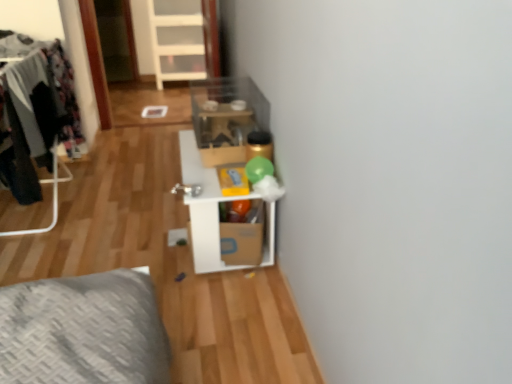
Image resolution: width=512 pixels, height=384 pixels. In order to click on white plastic ladder at upper center in this screenshot , I will do `click(178, 40)`.

The width and height of the screenshot is (512, 384). What do you see at coordinates (178, 40) in the screenshot?
I see `white plastic ladder at upper center` at bounding box center [178, 40].

Describe the element at coordinates (243, 240) in the screenshot. The image size is (512, 384). I see `cardboard box at center` at that location.

Identify the location of white cardboard shelf at center. This screenshot has height=384, width=512. (204, 208).

You are a GUI agent. You are given a task and a screenshot of the screen. Output one action in this format:
    pyautogui.click(x=<x>, y=<y>)
    Task: Click on the clothing lying on the left of white cardboard shelf at center
    
    Given the screenshot: What is the action you would take?
    pyautogui.click(x=37, y=118)

Based on the photo, how distant is dark gray fabric clothes at left from white cardboard shelf at center?

A distance of 31.70 inches exists between dark gray fabric clothes at left and white cardboard shelf at center.

Considering the positions of objects dark gray fabric clothes at left and white cardboard shelf at center in the image provided, who is more to the left, dark gray fabric clothes at left or white cardboard shelf at center?

Positioned to the left is dark gray fabric clothes at left.

Considering the relative sizes of dark gray fabric clothes at left and white cardboard shelf at center in the image provided, is dark gray fabric clothes at left bigger than white cardboard shelf at center?

No.

Do you think white cardboard shelf at center is within dark gray fabric clothes at left, or outside of it?

white cardboard shelf at center is not enclosed by dark gray fabric clothes at left.

Looking at this image, measure the distance from white cardboard shelf at center to dark gray fabric clothes at left.

They are 31.70 inches apart.

Is white cardboard shelf at center with dark gray fabric clothes at left?

No, white cardboard shelf at center is not with dark gray fabric clothes at left.

From the image's perspective, is white cardboard shelf at center positioned above or below dark gray fabric clothes at left?

white cardboard shelf at center is situated lower than dark gray fabric clothes at left in the image.

Is white plastic ladder at upper center inside the boundaries of white cardboard shelf at center, or outside?

white plastic ladder at upper center is not enclosed by white cardboard shelf at center.

Which is more to the right, white plastic ladder at upper center or white cardboard shelf at center?

white cardboard shelf at center.

From a real-world perspective, is white plastic ladder at upper center on top of white cardboard shelf at center?

Yes.

Is white plastic ladder at upper center taller or shorter than white cardboard shelf at center?

In the image, white plastic ladder at upper center appears to be taller than white cardboard shelf at center.

From a real-world perspective, is cardboard box at center above or below dark gray fabric clothes at left?

cardboard box at center is below dark gray fabric clothes at left.

Can you confirm if cardboard box at center is positioned to the right of dark gray fabric clothes at left?

Yes, cardboard box at center is to the right of dark gray fabric clothes at left.

Consider the image. Is cardboard box at center not inside dark gray fabric clothes at left?

Yes, cardboard box at center is outside of dark gray fabric clothes at left.

Which of these two, cardboard box at center or dark gray fabric clothes at left, stands shorter?

cardboard box at center is shorter.

Is dark gray fabric clothes at left shorter than white plastic ladder at upper center?

Correct, dark gray fabric clothes at left is not as tall as white plastic ladder at upper center.

Can we say dark gray fabric clothes at left lies outside white plastic ladder at upper center?

Yes, dark gray fabric clothes at left is outside of white plastic ladder at upper center.

Between dark gray fabric clothes at left and white plastic ladder at upper center, which one has smaller size?

dark gray fabric clothes at left is smaller.

Identify the location of shelf lying above the cardboard box at center (from the image's perspective). The height and width of the screenshot is (384, 512). (204, 208).

From the image's perspective, is cardboard box at center beneath white cardboard shelf at center?

Indeed, from the image's perspective, cardboard box at center is shown beneath white cardboard shelf at center.

From the picture: Considering the positions of objects cardboard box at center and white cardboard shelf at center in the image provided, who is more to the left, cardboard box at center or white cardboard shelf at center?

From the viewer's perspective, white cardboard shelf at center appears more on the left side.

Between white plastic ladder at upper center and dark gray fabric clothes at left, which one has more height?

white plastic ladder at upper center.

From the picture: Is white plastic ladder at upper center to the left or to the right of dark gray fabric clothes at left in the image?

In the image, white plastic ladder at upper center appears on the right side of dark gray fabric clothes at left.

What's the angular difference between white plastic ladder at upper center and dark gray fabric clothes at left's facing directions?

The angular difference between white plastic ladder at upper center and dark gray fabric clothes at left is 91.7 degrees.

Is white plastic ladder at upper center in contact with dark gray fabric clothes at left?

No, white plastic ladder at upper center is not touching dark gray fabric clothes at left.

Find the location of a particular element. This screenshot has height=384, width=512. clothing that appears behind the white cardboard shelf at center is located at coordinates (37, 118).

Locate an element on the screen. This screenshot has height=384, width=512. shelf to the right of dark gray fabric clothes at left is located at coordinates (204, 208).

Looking at this image, from the image, which object appears to be nearer to white plastic ladder at upper center, cardboard box at center or dark gray fabric clothes at left?

dark gray fabric clothes at left is positioned closer to the anchor white plastic ladder at upper center.

Looking at the image, which one is located further to white cardboard shelf at center, cardboard box at center or white plastic ladder at upper center?

The object further to white cardboard shelf at center is white plastic ladder at upper center.

Based on their spatial positions, is dark gray fabric clothes at left or white cardboard shelf at center closer to white plastic ladder at upper center?

dark gray fabric clothes at left lies closer to white plastic ladder at upper center than the other object.

Which object lies nearer to the anchor point cardboard box at center, dark gray fabric clothes at left or white cardboard shelf at center?

white cardboard shelf at center is closer to cardboard box at center.

Consider the image. When comparing their distances from white plastic ladder at upper center, does dark gray fabric clothes at left or cardboard box at center seem closer?

Based on the image, dark gray fabric clothes at left appears to be nearer to white plastic ladder at upper center.

Which object lies further to the anchor point white cardboard shelf at center, white plastic ladder at upper center or dark gray fabric clothes at left?

The object further to white cardboard shelf at center is white plastic ladder at upper center.

When comparing their distances from dark gray fabric clothes at left, does cardboard box at center or white plastic ladder at upper center seem closer?

cardboard box at center is closer to dark gray fabric clothes at left.

From the image, which object appears to be farther from dark gray fabric clothes at left, white plastic ladder at upper center or white cardboard shelf at center?

The object further to dark gray fabric clothes at left is white plastic ladder at upper center.

Identify the location of cardboard box located between dark gray fabric clothes at left and white plastic ladder at upper center in the depth direction. (243, 240).

I want to click on shelf located between dark gray fabric clothes at left and cardboard box at center in the left-right direction, so click(204, 208).

The image size is (512, 384). Identify the location of clothing between white cardboard shelf at center and white plastic ladder at upper center in the front-back direction. (37, 118).

The image size is (512, 384). Find the location of `cardboard box between white cardboard shelf at center and white plastic ladder at upper center along the z-axis`. cardboard box between white cardboard shelf at center and white plastic ladder at upper center along the z-axis is located at coordinates (243, 240).